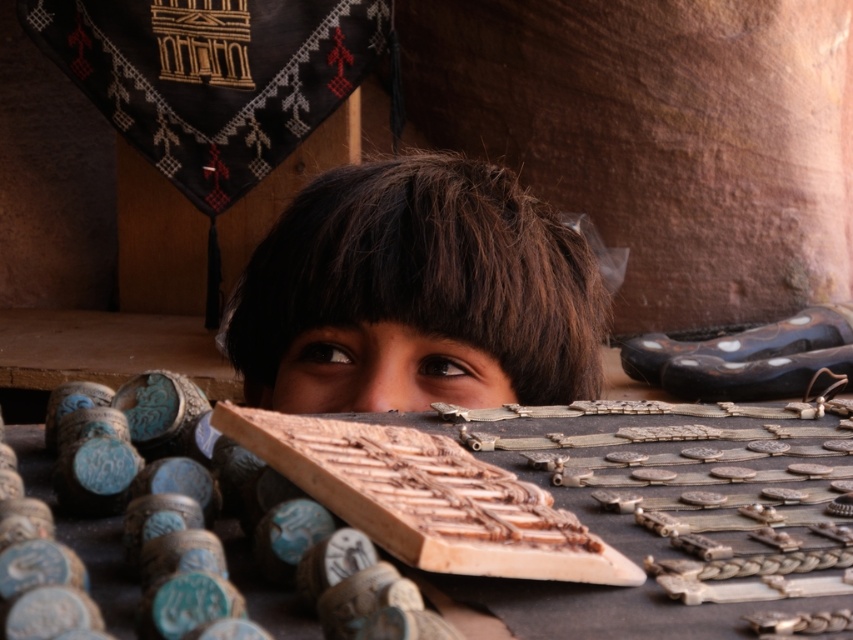
You are a customer in the shop and want to pick up both items located at point (444, 355) and point (469, 355). Which item should you reach for first to grab the closer one?

You should reach for the item at point (444, 355) first because it is closer to you than the item at point (469, 355).

You are an artist trying to sketch the scene. The child has a distinct feature called brown matte hair at center. If you want to draw this feature precisely, where should you place it on your canvas using coordinates?

The brown matte hair at center should be placed at coordinates point (x=418, y=291) on the canvas.

You are a photographer trying to capture the child in the image. The child is at point (407,328). If your camera is 26.36 inches away from this point, will you be able to clearly see the child in your shot?

Yes, since the camera is 26.36 inches away from the child at point (407,328), the child should be clearly visible in the photograph.